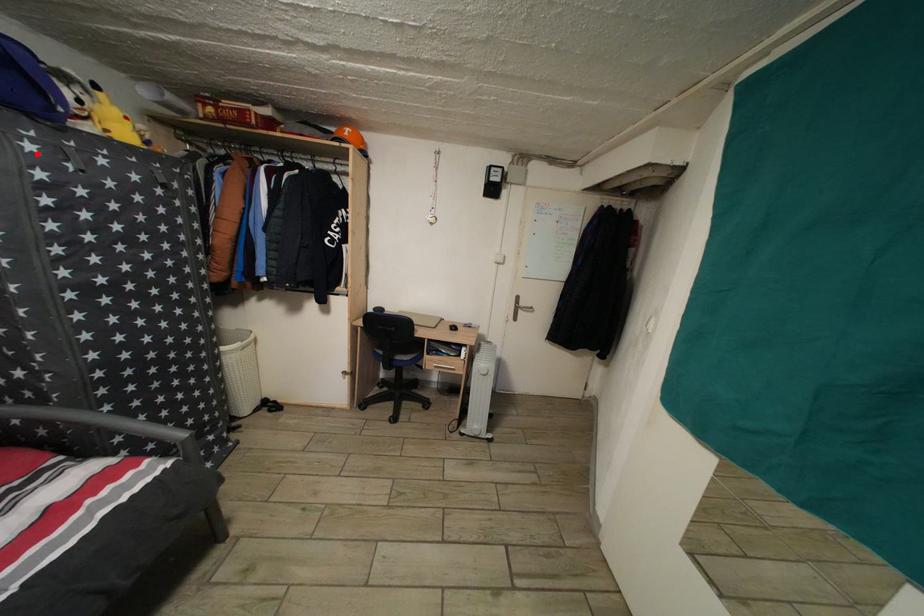
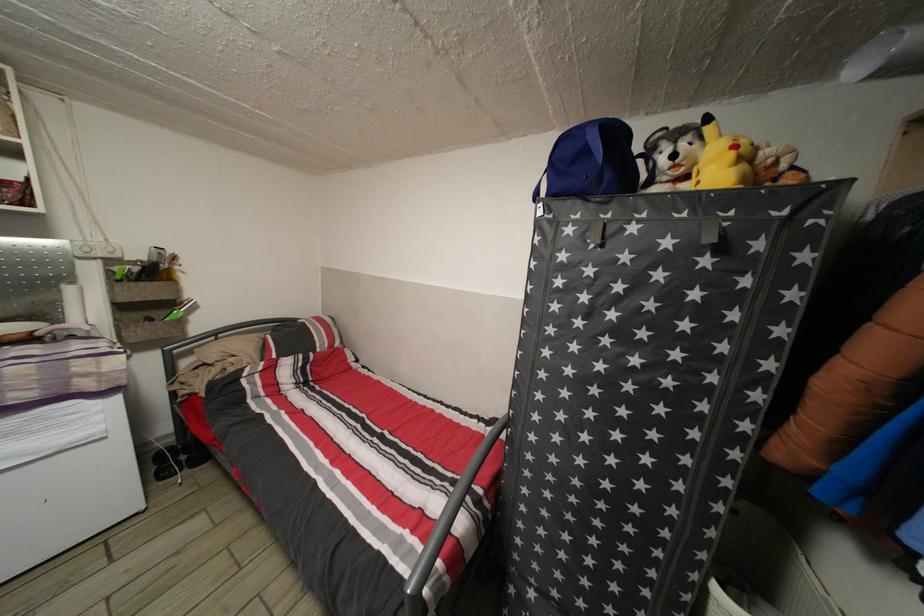
Find the pixel in the second image that matches the highlighted location in the first image.

(576, 237)